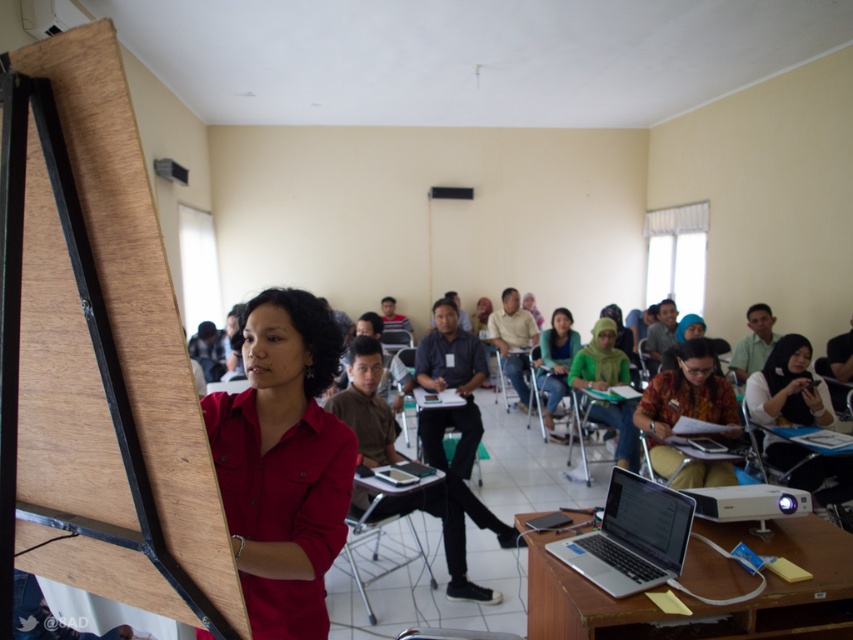
Looking at this image, you are organizing a clothing display in a store and need to arrange two shirts from left to right based on their sizes. The shirts available are the matte green shirt at center and the green fabric shirt at center. Which shirt should be placed on the left side to follow the size order from largest to smallest?

The matte green shirt at center should be placed on the left side since it has a larger width than the green fabric shirt at center, following the size order from largest to smallest.

You are a student sitting in the classroom and notice two shirts at the center of the room. Which one is taller, the matte green shirt at center or the green fabric shirt at center?

The matte green shirt at center is taller than the green fabric shirt at center.